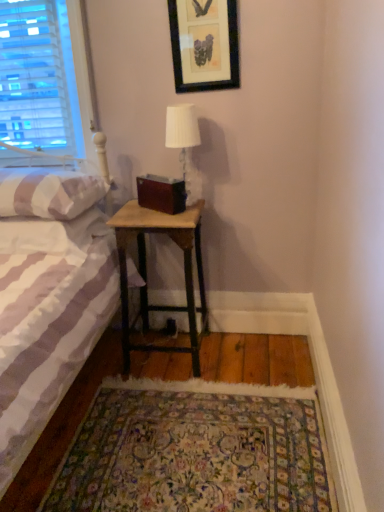
Question: Is woodenmaterial/texturenightstand at lower center smaller than white striped pillow at left?

Choices:
 (A) yes
 (B) no

Answer: (B)

Question: Does woodenmaterial/texturenightstand at lower center have a lesser width compared to white striped pillow at left?

Choices:
 (A) yes
 (B) no

Answer: (A)

Question: Is woodenmaterial/texturenightstand at lower center shorter than white striped pillow at left?

Choices:
 (A) no
 (B) yes

Answer: (A)

Question: From a real-world perspective, is woodenmaterial/texturenightstand at lower center on top of white striped pillow at left?

Choices:
 (A) no
 (B) yes

Answer: (A)

Question: Does woodenmaterial/texturenightstand at lower center turn towards white striped pillow at left?

Choices:
 (A) yes
 (B) no

Answer: (B)

Question: Is woodenmaterial/texturenightstand at lower center taller than white striped pillow at left?

Choices:
 (A) no
 (B) yes

Answer: (B)

Question: Is the position of black framed picture at upper center less distant than that of white striped pillow at left?

Choices:
 (A) yes
 (B) no

Answer: (B)

Question: From the image's perspective, would you say black framed picture at upper center is positioned over white striped pillow at left?

Choices:
 (A) yes
 (B) no

Answer: (A)

Question: From the image's perspective, is black framed picture at upper center beneath white striped pillow at left?

Choices:
 (A) no
 (B) yes

Answer: (A)

Question: Is black framed picture at upper center facing towards white striped pillow at left?

Choices:
 (A) no
 (B) yes

Answer: (A)

Question: Is black framed picture at upper center further to the viewer compared to white striped pillow at left?

Choices:
 (A) no
 (B) yes

Answer: (B)

Question: From a real-world perspective, is black framed picture at upper center positioned under white striped pillow at left based on gravity?

Choices:
 (A) no
 (B) yes

Answer: (A)

Question: Does white fabric lampshade at upper center have a greater width compared to white striped fabric bed at left?

Choices:
 (A) yes
 (B) no

Answer: (B)